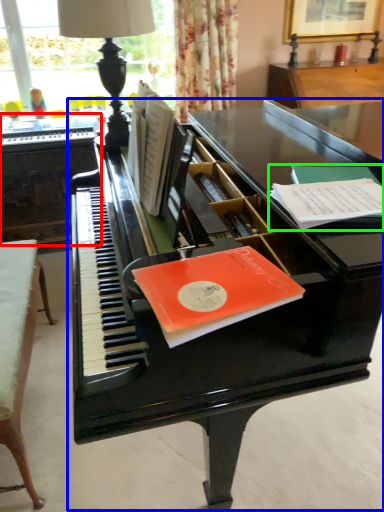
Question: Considering the real-world distances, which object is farthest from table (highlighted by a red box)? piano (highlighted by a blue box) or paperback book (highlighted by a green box)?

Choices:
 (A) piano
 (B) paperback book

Answer: (B)